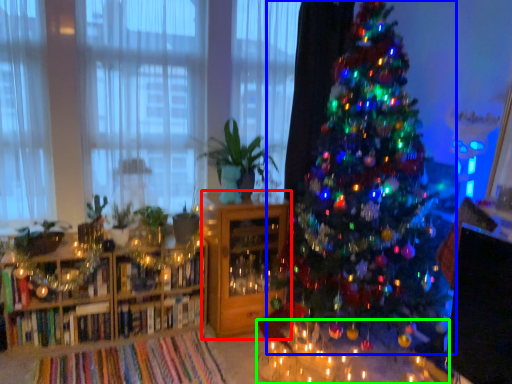
Question: Which is farther away from shelf (highlighted by a red box)? christmas tree (highlighted by a blue box) or table (highlighted by a green box)?

Choices:
 (A) christmas tree
 (B) table

Answer: (A)